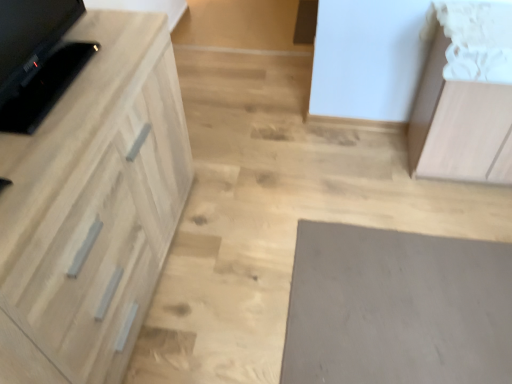
Question: From a real-world perspective, is light wood cabinet at left, acting as the 2th cabinetry starting from the right, above or below black glossy tv at left?

Choices:
 (A) below
 (B) above

Answer: (A)

Question: Would you say light wood cabinet at left, acting as the 2th cabinetry starting from the right, is inside or outside black glossy tv at left?

Choices:
 (A) inside
 (B) outside

Answer: (B)

Question: Estimate the real-world distances between objects in this image. Which object is closer to the black glossy tv at left?

Choices:
 (A) light brown wood cabinet at upper right, the 1th cabinetry when ordered from right to left
 (B) gray matte mat at lower right
 (C) light wood cabinet at left, the 1th cabinetry when ordered from left to right

Answer: (C)

Question: Considering the real-world distances, which object is farthest from the black glossy tv at left?

Choices:
 (A) light brown wood cabinet at upper right, the 1th cabinetry when ordered from right to left
 (B) gray matte mat at lower right
 (C) light wood cabinet at left, the 1th cabinetry when ordered from left to right

Answer: (A)